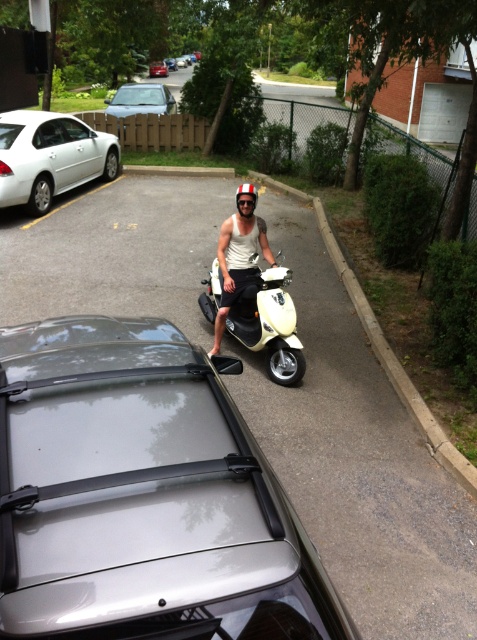
Question: From the image, what is the correct spatial relationship of metallic silver sedan at center in relation to red matte helmet at center?

Choices:
 (A) right
 (B) left

Answer: (B)

Question: Which point appears closest to the camera in this image?

Choices:
 (A) (101, 364)
 (B) (250, 292)

Answer: (A)

Question: Is white glossy sedan at left further to the viewer compared to silver metallic sedan at upper left?

Choices:
 (A) yes
 (B) no

Answer: (B)

Question: Which of these objects is positioned farthest from the silver metallic car at lower left?

Choices:
 (A) white glossy sedan at left
 (B) metallic silver sedan at center

Answer: (B)

Question: Which object is the farthest from the silver metallic car at lower left?

Choices:
 (A) metallic silver sedan at center
 (B) red matte helmet at center
 (C) silver metallic sedan at upper left
 (D) white matte scooter at center

Answer: (A)

Question: Is white matte scooter at center above white matte tank top at center?

Choices:
 (A) yes
 (B) no

Answer: (B)